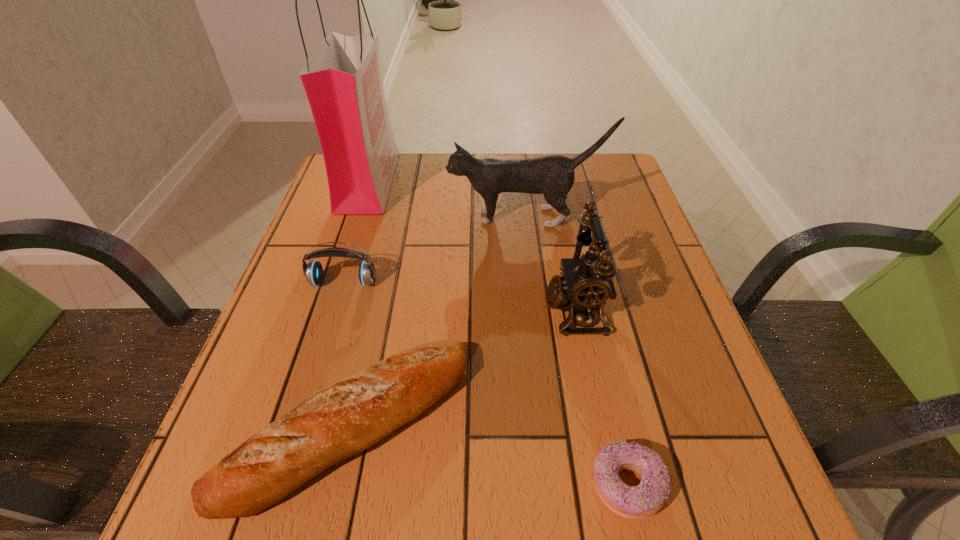
The height and width of the screenshot is (540, 960). What are the coordinates of `vacant region located 0.050m on the rotary dial of the fourth shortest object` in the screenshot? It's located at (519, 309).

The image size is (960, 540). Find the location of `blank area located on the rotary dial of the fourth shortest object`. blank area located on the rotary dial of the fourth shortest object is located at coordinates (474, 309).

Identify the location of vacant space located 0.360m on the rotary dial of the fourth shortest object. (365, 309).

Where is `free space located on the ear cups of the headset`? free space located on the ear cups of the headset is located at coordinates click(x=321, y=355).

Image resolution: width=960 pixels, height=540 pixels. In order to click on vacant point located 0.060m on the back of the second shortest object in this screenshot , I will do coord(372,326).

Find the location of `free location located on the back of the doughnut`. free location located on the back of the doughnut is located at coordinates (610, 409).

Find the location of a particular element. object located at the far edge is located at coordinates (343, 82).

At what (x,y) coordinates should I click in order to perform the action: click on baguet present at the near edge. Please return your answer as a coordinate pair (x, y). Looking at the image, I should click on (341, 420).

Where is `doughnut present at the near edge`? The image size is (960, 540). doughnut present at the near edge is located at coordinates (638, 502).

Where is `shopping bag that is at the left edge`? The width and height of the screenshot is (960, 540). shopping bag that is at the left edge is located at coordinates (x=343, y=82).